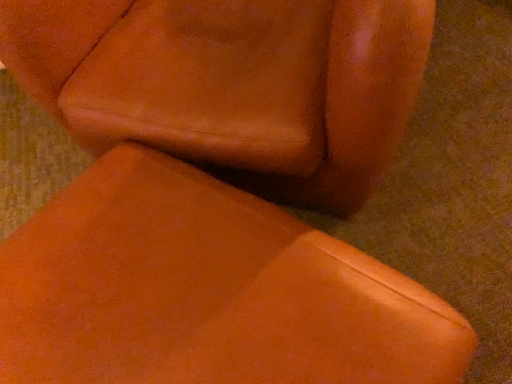
What do you see at coordinates (206, 291) in the screenshot? I see `matte leather chair at center, positioned as the second chair in top-to-bottom order` at bounding box center [206, 291].

Locate an element on the screen. matte leather chair at center, positioned as the second chair in top-to-bottom order is located at coordinates (206, 291).

Where is `leather chair at center, arranged as the 1th chair when viewed from the top`? leather chair at center, arranged as the 1th chair when viewed from the top is located at coordinates (232, 84).

The width and height of the screenshot is (512, 384). Describe the element at coordinates (232, 84) in the screenshot. I see `leather chair at center, the 2th chair ordered from the bottom` at that location.

Find the location of a particular element. This screenshot has width=512, height=384. matte leather chair at center, positioned as the second chair in top-to-bottom order is located at coordinates (206, 291).

Which object is positioned more to the left, leather chair at center, the 2th chair ordered from the bottom, or matte leather chair at center, the 1th chair in the bottom-to-top sequence?

matte leather chair at center, the 1th chair in the bottom-to-top sequence.

In the image, is leather chair at center, the 2th chair ordered from the bottom, positioned in front of or behind matte leather chair at center, positioned as the second chair in top-to-bottom order?

Clearly, leather chair at center, the 2th chair ordered from the bottom, is behind matte leather chair at center, positioned as the second chair in top-to-bottom order.

Considering the points (395, 61) and (96, 176), which point is in front, point (395, 61) or point (96, 176)?

The point (395, 61) is closer to the camera.

From the image's perspective, is leather chair at center, arranged as the 1th chair when viewed from the top, on top of matte leather chair at center, positioned as the second chair in top-to-bottom order?

Indeed, from the image's perspective, leather chair at center, arranged as the 1th chair when viewed from the top, is shown above matte leather chair at center, positioned as the second chair in top-to-bottom order.

From a real-world perspective, is leather chair at center, the 2th chair ordered from the bottom, on top of matte leather chair at center, positioned as the second chair in top-to-bottom order?

Indeed, from a real-world perspective, leather chair at center, the 2th chair ordered from the bottom, stands above matte leather chair at center, positioned as the second chair in top-to-bottom order.

Can you confirm if leather chair at center, the 2th chair ordered from the bottom, is thinner than matte leather chair at center, positioned as the second chair in top-to-bottom order?

No, leather chair at center, the 2th chair ordered from the bottom, is not thinner than matte leather chair at center, positioned as the second chair in top-to-bottom order.

Considering the sizes of objects leather chair at center, the 2th chair ordered from the bottom, and matte leather chair at center, positioned as the second chair in top-to-bottom order, in the image provided, who is shorter, leather chair at center, the 2th chair ordered from the bottom, or matte leather chair at center, positioned as the second chair in top-to-bottom order,?

matte leather chair at center, positioned as the second chair in top-to-bottom order.

In the scene shown: Who is bigger, leather chair at center, arranged as the 1th chair when viewed from the top, or matte leather chair at center, the 1th chair in the bottom-to-top sequence?

Bigger between the two is leather chair at center, arranged as the 1th chair when viewed from the top.

Is leather chair at center, the 2th chair ordered from the bottom, situated inside matte leather chair at center, positioned as the second chair in top-to-bottom order, or outside?

leather chair at center, the 2th chair ordered from the bottom, cannot be found inside matte leather chair at center, positioned as the second chair in top-to-bottom order.

Is leather chair at center, arranged as the 1th chair when viewed from the top, far away from matte leather chair at center, the 1th chair in the bottom-to-top sequence?

No, leather chair at center, arranged as the 1th chair when viewed from the top, is in close proximity to matte leather chair at center, the 1th chair in the bottom-to-top sequence.

Is leather chair at center, arranged as the 1th chair when viewed from the top, oriented towards matte leather chair at center, positioned as the second chair in top-to-bottom order?

Yes, leather chair at center, arranged as the 1th chair when viewed from the top, is facing matte leather chair at center, positioned as the second chair in top-to-bottom order.

Measure the distance between leather chair at center, the 2th chair ordered from the bottom, and matte leather chair at center, positioned as the second chair in top-to-bottom order.

leather chair at center, the 2th chair ordered from the bottom, is 10.41 inches from matte leather chair at center, positioned as the second chair in top-to-bottom order.

In order to click on chair on the right of matte leather chair at center, positioned as the second chair in top-to-bottom order in this screenshot , I will do `click(232, 84)`.

Does matte leather chair at center, the 1th chair in the bottom-to-top sequence, appear on the right side of leather chair at center, arranged as the 1th chair when viewed from the top?

Incorrect, matte leather chair at center, the 1th chair in the bottom-to-top sequence, is not on the right side of leather chair at center, arranged as the 1th chair when viewed from the top.

In the scene shown: Does matte leather chair at center, the 1th chair in the bottom-to-top sequence, come behind leather chair at center, the 2th chair ordered from the bottom?

No, it is not.

Is point (403, 279) positioned after point (327, 93)?

No, it is not.

Consider the image. From the image's perspective, which object appears higher, matte leather chair at center, positioned as the second chair in top-to-bottom order, or leather chair at center, arranged as the 1th chair when viewed from the top?

leather chair at center, arranged as the 1th chair when viewed from the top, appears higher in the image.

From a real-world perspective, who is located lower, matte leather chair at center, the 1th chair in the bottom-to-top sequence, or leather chair at center, arranged as the 1th chair when viewed from the top?

From a 3D spatial view, matte leather chair at center, the 1th chair in the bottom-to-top sequence, is below.

Which object is wider, matte leather chair at center, positioned as the second chair in top-to-bottom order, or leather chair at center, the 2th chair ordered from the bottom?

Wider between the two is leather chair at center, the 2th chair ordered from the bottom.

Between matte leather chair at center, positioned as the second chair in top-to-bottom order, and leather chair at center, the 2th chair ordered from the bottom, which one has less height?

matte leather chair at center, positioned as the second chair in top-to-bottom order, is shorter.

Does matte leather chair at center, the 1th chair in the bottom-to-top sequence, have a larger size compared to leather chair at center, the 2th chair ordered from the bottom?

No.

Which is correct: matte leather chair at center, the 1th chair in the bottom-to-top sequence, is inside leather chair at center, arranged as the 1th chair when viewed from the top, or outside of it?

matte leather chair at center, the 1th chair in the bottom-to-top sequence, is outside leather chair at center, arranged as the 1th chair when viewed from the top.

Is matte leather chair at center, positioned as the second chair in top-to-bottom order, not near leather chair at center, the 2th chair ordered from the bottom?

They are positioned close to each other.

Could you tell me if matte leather chair at center, positioned as the second chair in top-to-bottom order, is turned towards leather chair at center, the 2th chair ordered from the bottom?

No, matte leather chair at center, positioned as the second chair in top-to-bottom order, does not turn towards leather chair at center, the 2th chair ordered from the bottom.

Measure the distance between matte leather chair at center, positioned as the second chair in top-to-bottom order, and leather chair at center, the 2th chair ordered from the bottom.

10.41 inches.

The height and width of the screenshot is (384, 512). In the image, there is a matte leather chair at center, positioned as the second chair in top-to-bottom order. What are the coordinates of `chair above it (from the image's perspective)` in the screenshot? It's located at (232, 84).

I want to click on chair below the leather chair at center, the 2th chair ordered from the bottom (from the image's perspective), so click(206, 291).

The image size is (512, 384). Identify the location of chair on the left of leather chair at center, arranged as the 1th chair when viewed from the top. (206, 291).